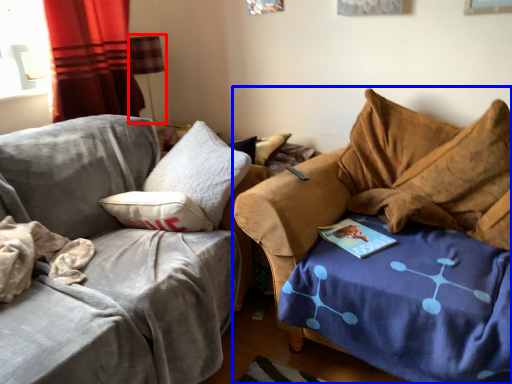
Question: Which object appears closest to the camera in this image, lamp (highlighted by a red box) or studio couch (highlighted by a blue box)?

Choices:
 (A) lamp
 (B) studio couch

Answer: (B)